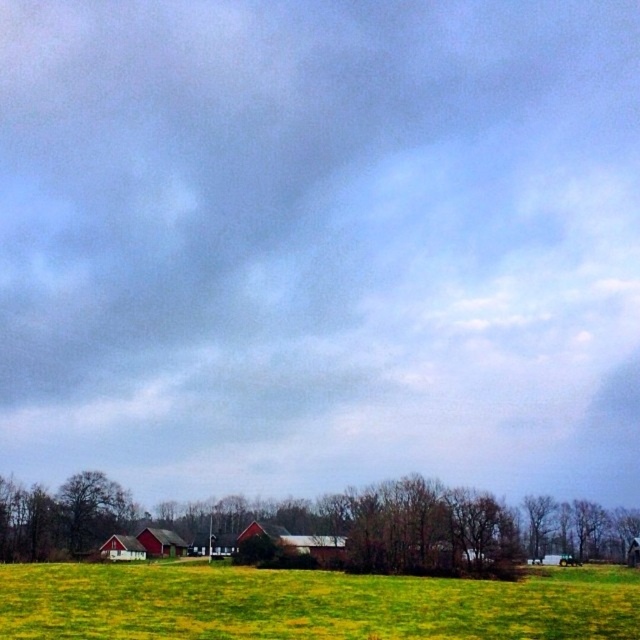
Who is shorter, brown textured tree at lower center or green leafy tree at lower right?

Standing shorter between the two is green leafy tree at lower right.

Does brown textured tree at lower center have a smaller size compared to green leafy tree at lower right?

Actually, brown textured tree at lower center might be larger than green leafy tree at lower right.

Identify the location of brown textured tree at lower center. The height and width of the screenshot is (640, 640). (310, 528).

Is point (504, 584) in front of point (541, 499)?

Yes, it is in front of point (541, 499).

Which is in front, point (627, 632) or point (538, 554)?

Point (627, 632)

This screenshot has width=640, height=640. Identify the location of green grass pasture at lower center. (308, 604).

Who is lower down, green grass pasture at lower center or brown textured tree at lower center?

brown textured tree at lower center is below.

Is green grass pasture at lower center shorter than brown textured tree at lower center?

Incorrect, green grass pasture at lower center's height does not fall short of brown textured tree at lower center's.

Who is more distant from viewer, (349,595) or (196,534)?

The point (196,534) is more distant.

The height and width of the screenshot is (640, 640). In order to click on green grass pasture at lower center in this screenshot , I will do `click(308, 604)`.